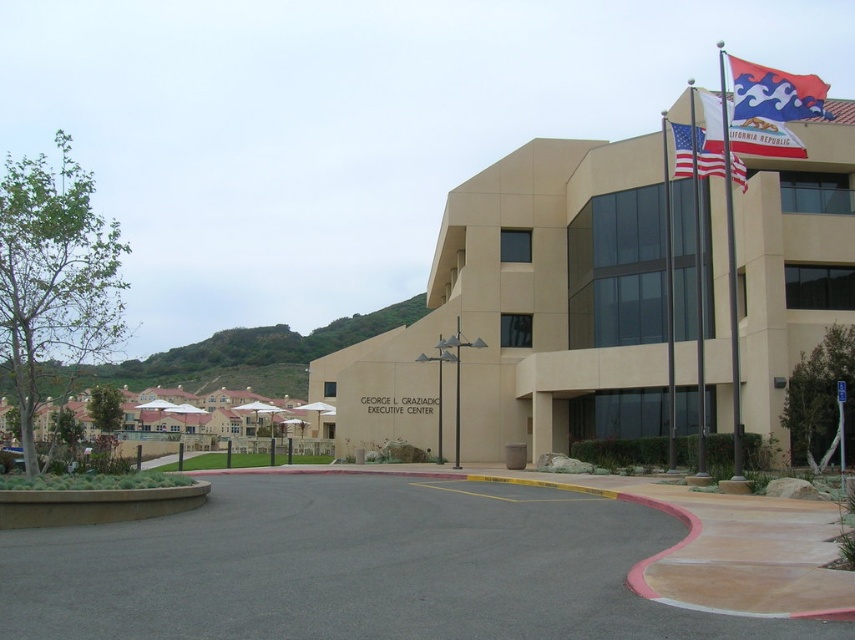
Question: Is blue and white fabric flag at upper right to the left of metallic flag pole at upper right from the viewer's perspective?

Choices:
 (A) no
 (B) yes

Answer: (A)

Question: Which is farther from the white flagpole at upper right?

Choices:
 (A) beige concrete building at upper right
 (B) red fabric flag at upper right
 (C) blue and white fabric flag at upper right
 (D) metallic flag pole at upper right

Answer: (A)

Question: Is red fabric flag at upper right above white flagpole at upper right?

Choices:
 (A) no
 (B) yes

Answer: (A)

Question: Estimate the real-world distances between objects in this image. Which object is farther from the blue and white fabric flag at upper right?

Choices:
 (A) american flag at upper right
 (B) metallic flag pole at upper right
 (C) beige concrete building at upper right

Answer: (A)

Question: Which point is farther to the camera?

Choices:
 (A) (668, 211)
 (B) (720, 54)
 (C) (777, 88)

Answer: (B)

Question: Does beige concrete building at upper right have a greater width compared to american flag at upper right?

Choices:
 (A) yes
 (B) no

Answer: (A)